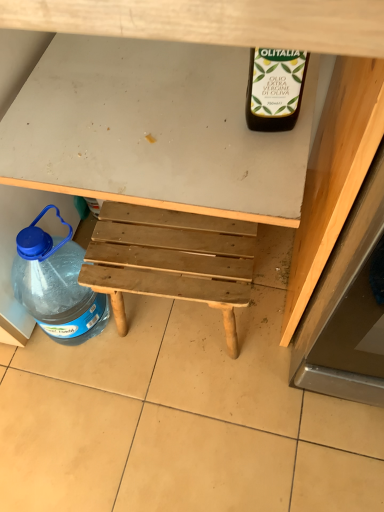
Image resolution: width=384 pixels, height=512 pixels. In order to click on empty space that is ontop of natural wood stool at center (from a real-world perspective) in this screenshot , I will do `click(168, 249)`.